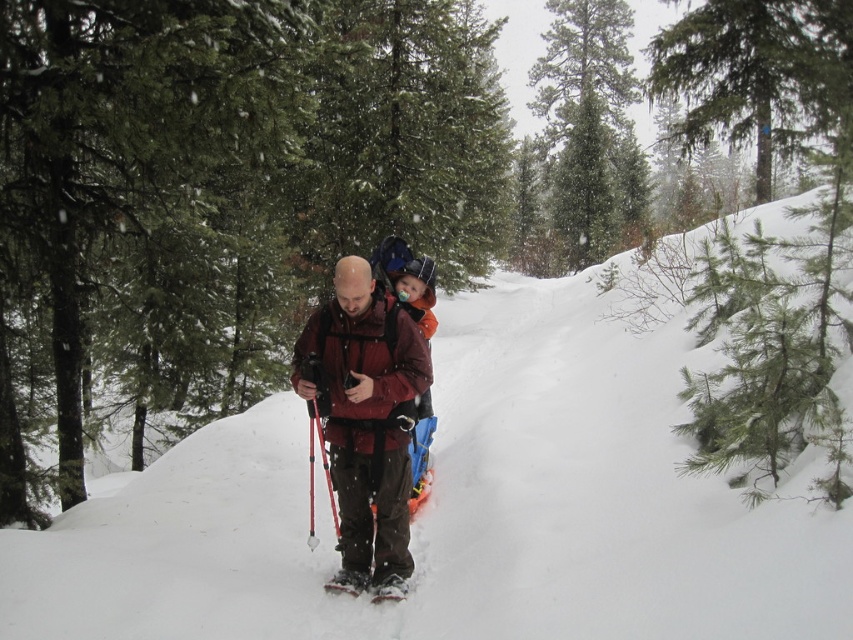
Can you confirm if matte red jacket at center is smaller than orange soft shell jacket at center?

Incorrect, matte red jacket at center is not smaller in size than orange soft shell jacket at center.

What are the coordinates of `matte red jacket at center` in the screenshot? It's located at (366, 412).

Between orange soft shell jacket at center and black rubber snowshoe at lower center, which one has more height?

orange soft shell jacket at center

Is orange soft shell jacket at center positioned in front of black rubber snowshoe at lower center?

No, it is not.

At what (x,y) coordinates should I click in order to perform the action: click on orange soft shell jacket at center. Please return your answer as a coordinate pair (x, y). Looking at the image, I should click on click(416, 291).

Can you confirm if white fluffy snow at center is taller than black rubber snowshoe at lower center?

Correct, white fluffy snow at center is much taller as black rubber snowshoe at lower center.

Does point (599, 552) come behind point (341, 568)?

No, (599, 552) is closer to viewer.

Identify the location of white fluffy snow at center. This screenshot has width=853, height=640. (457, 509).